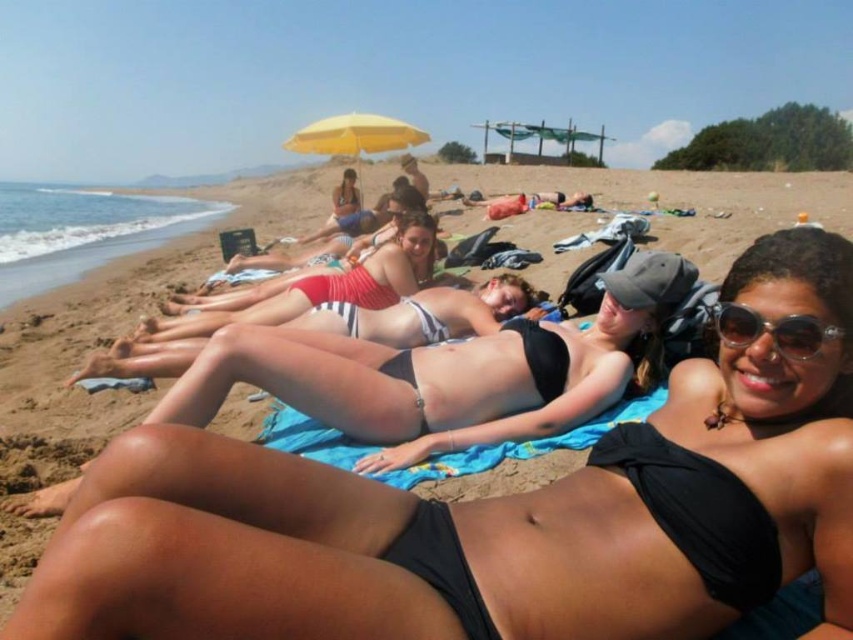
Which is above, black matte bikini top at lower center or yellow fabric umbrella at upper center?

yellow fabric umbrella at upper center is above.

Which of these two, black matte bikini top at lower center or yellow fabric umbrella at upper center, stands taller?

yellow fabric umbrella at upper center is taller.

Is point (589, 458) in front of point (344, 116)?

Yes, it is.

The height and width of the screenshot is (640, 853). What are the coordinates of `black matte bikini top at lower center` in the screenshot? It's located at (699, 513).

Between point (695, 483) and point (474, 333), which one is positioned in front?

Point (695, 483) is in front.

Which is below, black matte bikini top at lower center or black bikini at center?

Positioned lower is black matte bikini top at lower center.

Between point (730, 500) and point (515, 305), which one is positioned behind?

Positioned behind is point (515, 305).

Locate an element on the screen. Image resolution: width=853 pixels, height=640 pixels. black matte bikini top at lower center is located at coordinates (699, 513).

How distant is black matte bikini at center from yellow fabric umbrella at upper center?

A distance of 38.91 feet exists between black matte bikini at center and yellow fabric umbrella at upper center.

Does point (773, 476) come closer to viewer compared to point (323, 122)?

Yes, it is.

This screenshot has width=853, height=640. Identify the location of black matte bikini at center. (492, 515).

The image size is (853, 640). I want to click on black matte bikini at center, so click(x=492, y=515).